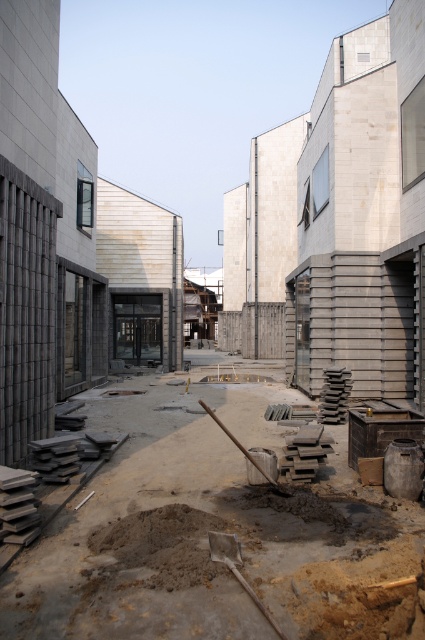
You are a construction worker carrying a 3.5 meter long pipe. You need to place it between the brown concrete at center and the metallic silver shovel at center. Is there enough space to place the pipe horizontally between them?

The distance between the brown concrete at center and the metallic silver shovel at center is 3.43 meters. Since the pipe is 3.5 meters long, it is slightly longer than the available space. Therefore, there is not enough space to place the pipe horizontally between them.

You are a construction worker who needs to choose a shovel to dig a narrow trench. You have two shovels available in the scene, the metallic silver shovel at center and the wooden shovel at center. Which shovel would be more suitable for digging a narrow trench?

The wooden shovel at center has a smaller width compared to the metallic silver shovel at center, making it more suitable for digging a narrow trench.

You are a construction worker who needs to move the wooden shovel at center to access the brown concrete at center. Can you lift the shovel to reach the concrete underneath?

The brown concrete at center is positioned under the wooden shovel at center, so lifting the shovel will allow access to the concrete underneath.